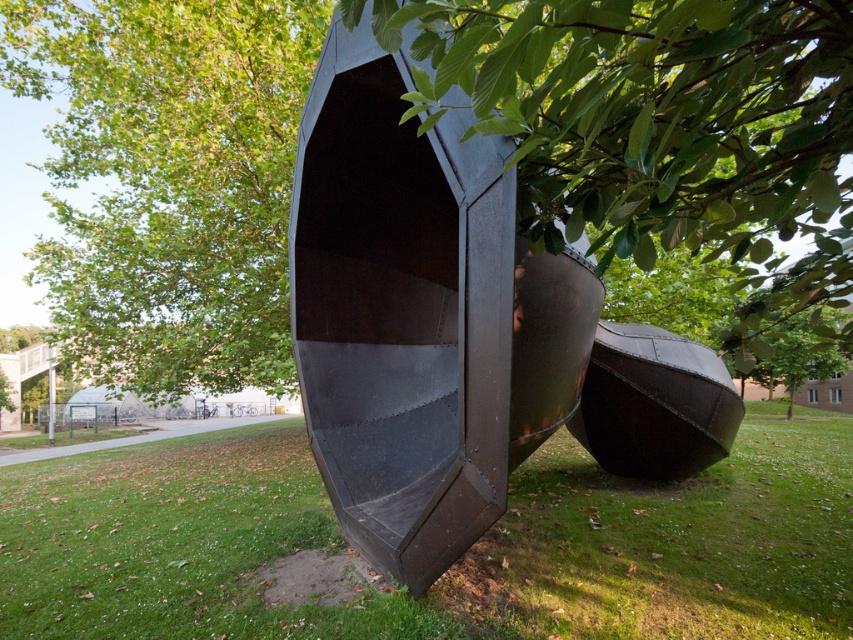
Question: Does green grass at lower center appear on the left side of green leafy tree at center?

Choices:
 (A) no
 (B) yes

Answer: (A)

Question: Which point is closer to the camera?

Choices:
 (A) green leafy tree at upper left
 (B) matte black boat at center
 (C) green grass at lower center

Answer: (C)

Question: Which object is the farthest from the green leafy tree at center?

Choices:
 (A) rustic metal boat at center
 (B) matte black boat at center
 (C) green leafy tree at upper left

Answer: (A)

Question: Which of the following is the farthest from the observer?

Choices:
 (A) tap(764, 544)
 (B) tap(715, 442)
 (C) tap(422, 396)
 (D) tap(744, 29)

Answer: (B)

Question: Is the position of green leafy tree at center less distant than that of rustic metal boat at center?

Choices:
 (A) yes
 (B) no

Answer: (A)

Question: Is rustic metal boat at center positioned in front of matte black boat at center?

Choices:
 (A) yes
 (B) no

Answer: (A)